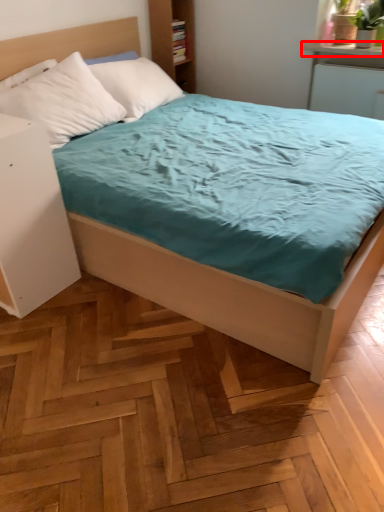
Question: From the image's perspective, considering the relative positions of window sill (annotated by the red box) and nightstand in the image provided, where is window sill (annotated by the red box) located with respect to the staircase?

Choices:
 (A) above
 (B) below

Answer: (A)